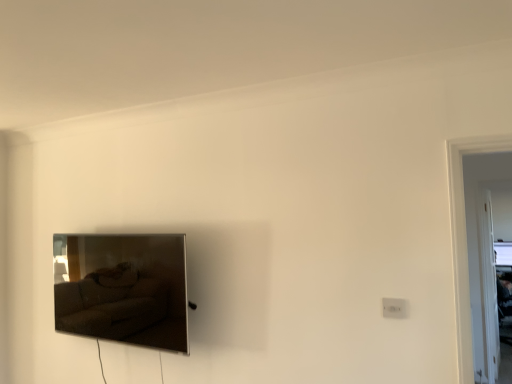
Question: From a real-world perspective, does matte black tv at left sit lower than white plastic electric outlet at lower right?

Choices:
 (A) no
 (B) yes

Answer: (A)

Question: Can you confirm if matte black tv at left is positioned to the right of white plastic electric outlet at lower right?

Choices:
 (A) no
 (B) yes

Answer: (A)

Question: From a real-world perspective, does matte black tv at left stand above white plastic electric outlet at lower right?

Choices:
 (A) yes
 (B) no

Answer: (A)

Question: Does matte black tv at left appear on the left side of white plastic electric outlet at lower right?

Choices:
 (A) no
 (B) yes

Answer: (B)

Question: Is white plastic electric outlet at lower right a part of matte black tv at left?

Choices:
 (A) no
 (B) yes

Answer: (A)

Question: Does matte black tv at left have a greater height compared to white plastic electric outlet at lower right?

Choices:
 (A) yes
 (B) no

Answer: (A)

Question: Can you confirm if white plastic electric outlet at lower right is shorter than matte black tv at left?

Choices:
 (A) no
 (B) yes

Answer: (B)

Question: From a real-world perspective, is white plastic electric outlet at lower right located beneath matte black tv at left?

Choices:
 (A) yes
 (B) no

Answer: (A)

Question: Is white plastic electric outlet at lower right bigger than matte black tv at left?

Choices:
 (A) no
 (B) yes

Answer: (A)

Question: From a real-world perspective, is white plastic electric outlet at lower right located higher than matte black tv at left?

Choices:
 (A) yes
 (B) no

Answer: (B)

Question: Does white plastic electric outlet at lower right appear on the left side of matte black tv at left?

Choices:
 (A) no
 (B) yes

Answer: (A)

Question: Would you say white plastic electric outlet at lower right is a long distance from matte black tv at left?

Choices:
 (A) yes
 (B) no

Answer: (A)

Question: Is matte black tv at left wider or thinner than white plastic electric outlet at lower right?

Choices:
 (A) wide
 (B) thin

Answer: (A)